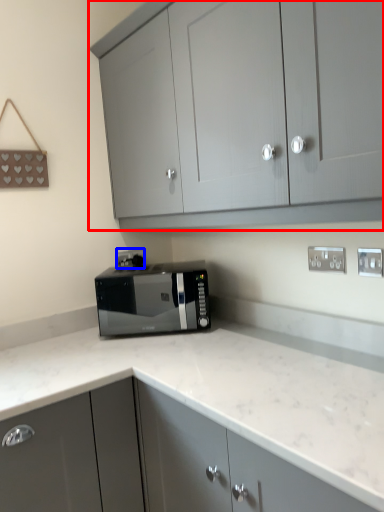
Question: Which object is further to the camera taking this photo, cabinetry (highlighted by a red box) or electric outlet (highlighted by a blue box)?

Choices:
 (A) cabinetry
 (B) electric outlet

Answer: (B)